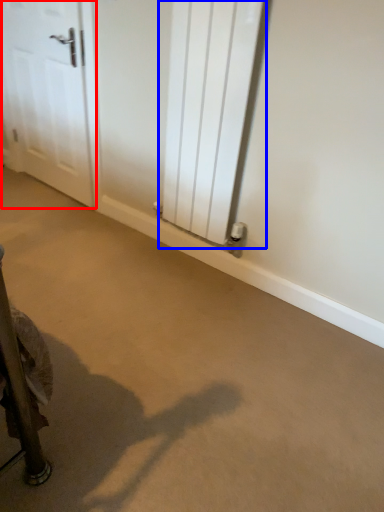
Question: Which point is further to the camera, door (highlighted by a red box) or radiator (highlighted by a blue box)?

Choices:
 (A) door
 (B) radiator

Answer: (A)